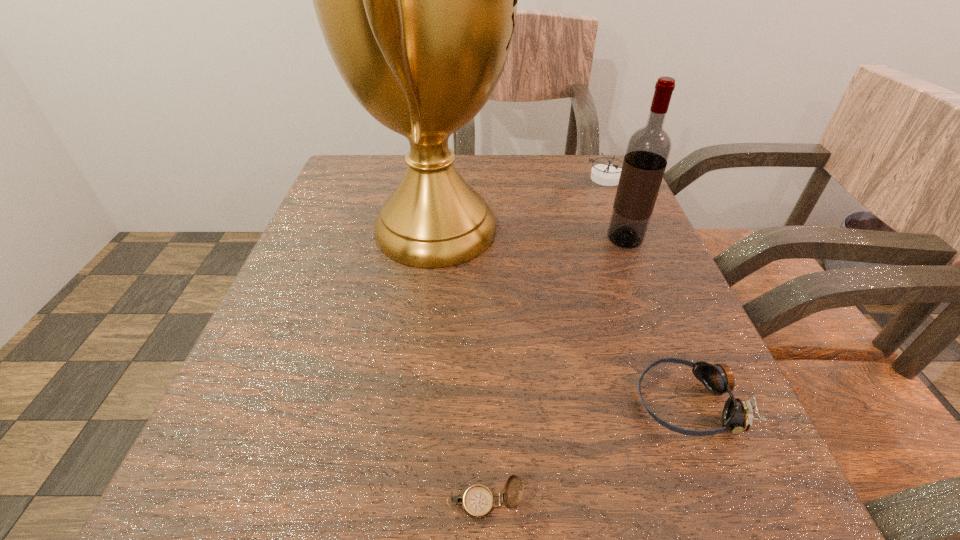
At what (x,y) coordinates should I click in order to perform the action: click on object that stands as the second closest to the tallest object. Please return your answer as a coordinate pair (x, y). The image size is (960, 540). Looking at the image, I should click on (648, 149).

Choose which object is the fourth nearest neighbor to the fourth farthest object. Please provide its 2D coordinates. Your answer should be formatted as a tuple, i.e. [(x, y)], where the tuple contains the x and y coordinates of a point satisfying the conditions above.

[(604, 174)]

Identify the location of free space that satisfies the following two spatial constraints: 1. on the back side of the fourth shortest object; 2. on the surface of the tallest object with symbols. point(621,230).

What are the coordinates of `vacant region that satisfies the following two spatial constraints: 1. on the surface of the trophy cup with symbols; 2. on the left side of the second tallest object` in the screenshot? It's located at (435, 239).

Identify the location of free region that satisfies the following two spatial constraints: 1. on the front side of the second tallest object; 2. on the face of the nearer compass. (731, 503).

Identify the location of free space that satisfies the following two spatial constraints: 1. on the front side of the wine bottle; 2. on the face of the nearest object. Image resolution: width=960 pixels, height=540 pixels. (731, 503).

The height and width of the screenshot is (540, 960). Find the location of `vacant position in the image that satisfies the following two spatial constraints: 1. on the surface of the tallest object with symbols; 2. on the left side of the wine bottle`. vacant position in the image that satisfies the following two spatial constraints: 1. on the surface of the tallest object with symbols; 2. on the left side of the wine bottle is located at coordinates click(x=435, y=239).